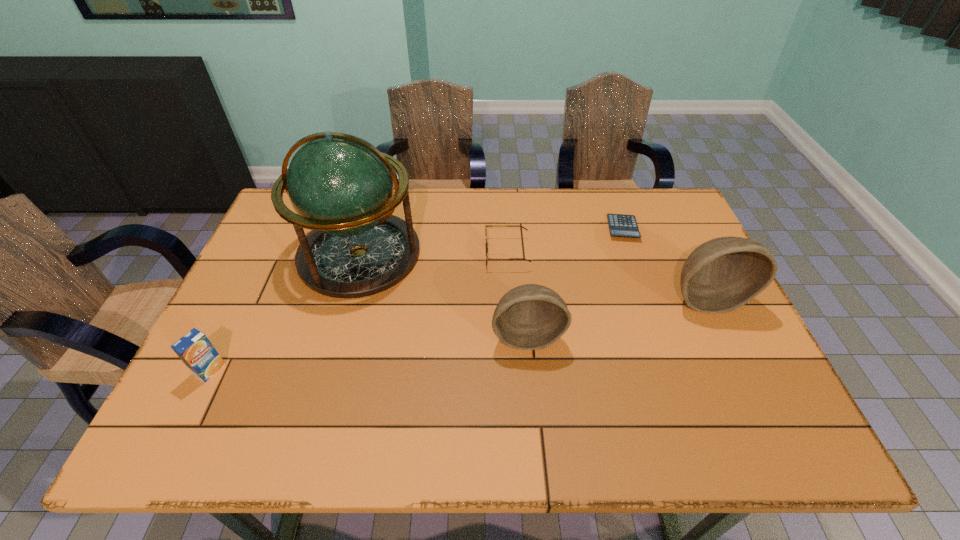
Identify the location of blank area located on the right of the left bowl. Image resolution: width=960 pixels, height=540 pixels. (709, 335).

Identify the location of vacant space located on the left of the right bowl. (638, 298).

Locate an element on the screen. vacant space located 0.170m on the front-facing side of the tallest object is located at coordinates (332, 353).

This screenshot has width=960, height=540. In order to click on vacant area located at the front view of the spectacles in this screenshot , I will do `click(363, 253)`.

At what (x,y) coordinates should I click in order to perform the action: click on free region located 0.290m at the front view of the spectacles. Please return your answer as a coordinate pair (x, y). Image resolution: width=960 pixels, height=540 pixels. Looking at the image, I should click on (387, 253).

Identify the location of vacant space situated 0.110m at the front view of the spectacles. The image size is (960, 540). (448, 253).

Image resolution: width=960 pixels, height=540 pixels. I want to click on free space located on the right of the calculator, so click(x=658, y=228).

This screenshot has height=540, width=960. In order to click on vacant space situated on the back of the nearest object in this screenshot , I will do `click(248, 295)`.

Image resolution: width=960 pixels, height=540 pixels. Find the location of `globe present at the far edge`. globe present at the far edge is located at coordinates (341, 187).

You are a GUI agent. You are given a task and a screenshot of the screen. Output one action in this format:
    pyautogui.click(x=<x>, y=<y>)
    Task: Click on the calculator located at the far edge
    
    Given the screenshot: What is the action you would take?
    pyautogui.click(x=621, y=225)